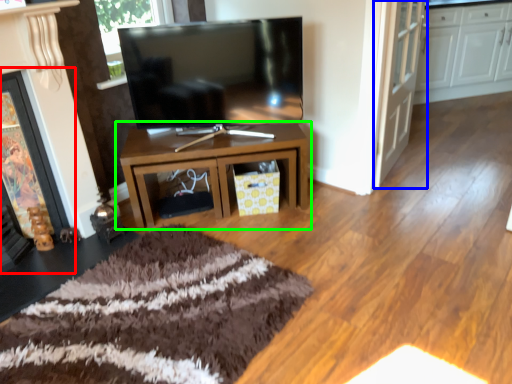
Question: Which is farther away from fireplace (highlighted by a red box)? door (highlighted by a blue box) or table (highlighted by a green box)?

Choices:
 (A) door
 (B) table

Answer: (A)